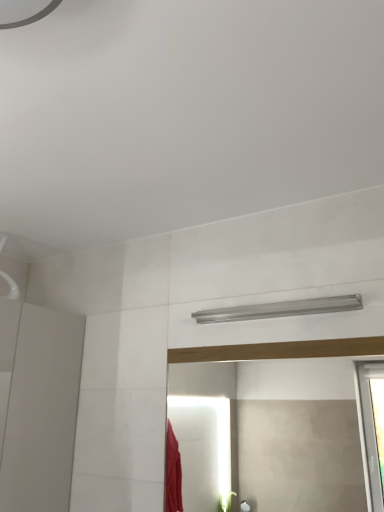
This screenshot has height=512, width=384. Describe the element at coordinates (288, 429) in the screenshot. I see `matte wooden mirror at center` at that location.

In order to click on matte wooden mirror at center in this screenshot , I will do `click(288, 429)`.

Describe the element at coordinates (280, 309) in the screenshot. I see `silver metallic shower at upper center` at that location.

Locate an element on the screen. This screenshot has height=512, width=384. silver metallic shower at upper center is located at coordinates 280,309.

At what (x,y) coordinates should I click in order to perform the action: click on matte wooden mirror at center. Please return your answer as a coordinate pair (x, y). The height and width of the screenshot is (512, 384). Looking at the image, I should click on (288, 429).

From the picture: Considering the relative positions of matte wooden mirror at center and silver metallic shower at upper center in the image provided, is matte wooden mirror at center to the left or to the right of silver metallic shower at upper center?

In the image, matte wooden mirror at center appears on the left side of silver metallic shower at upper center.

Which object is closer to the camera, matte wooden mirror at center or silver metallic shower at upper center?

matte wooden mirror at center is in front.

Does point (348, 385) come behind point (203, 318)?

No, (348, 385) is closer to viewer.

From the image's perspective, between matte wooden mirror at center and silver metallic shower at upper center, who is located below?

From the image's view, matte wooden mirror at center is below.

Based on the photo, from a real-world perspective, between matte wooden mirror at center and silver metallic shower at upper center, who is vertically higher?

silver metallic shower at upper center, from a real-world perspective.

Is matte wooden mirror at center wider or thinner than silver metallic shower at upper center?

Considering their sizes, matte wooden mirror at center looks slimmer than silver metallic shower at upper center.

Does matte wooden mirror at center have a greater height compared to silver metallic shower at upper center?

Indeed, matte wooden mirror at center has a greater height compared to silver metallic shower at upper center.

In terms of size, does matte wooden mirror at center appear bigger or smaller than silver metallic shower at upper center?

In the image, matte wooden mirror at center appears to be larger than silver metallic shower at upper center.

Is matte wooden mirror at center inside or outside of silver metallic shower at upper center?

matte wooden mirror at center exists outside the volume of silver metallic shower at upper center.

Are matte wooden mirror at center and silver metallic shower at upper center located far from each other?

Yes, matte wooden mirror at center and silver metallic shower at upper center are located far from each other.

Could you tell me if matte wooden mirror at center is turned towards silver metallic shower at upper center?

No, matte wooden mirror at center is not aimed at silver metallic shower at upper center.

What's the angular difference between matte wooden mirror at center and silver metallic shower at upper center's facing directions?

The angle between the facing direction of matte wooden mirror at center and the facing direction of silver metallic shower at upper center is 0.555 degrees.

The width and height of the screenshot is (384, 512). Identify the location of mirror to the left of silver metallic shower at upper center. (288, 429).

Which is more to the left, silver metallic shower at upper center or matte wooden mirror at center?

matte wooden mirror at center is more to the left.

Between silver metallic shower at upper center and matte wooden mirror at center, which one is positioned behind?

silver metallic shower at upper center is behind.

Considering the positions of points (279, 314) and (171, 388), is point (279, 314) farther from camera compared to point (171, 388)?

No, (279, 314) is closer to viewer.

From the image's perspective, is silver metallic shower at upper center positioned above or below matte wooden mirror at center?

Based on their image positions, silver metallic shower at upper center is located above matte wooden mirror at center.

Looking at this image, from a real-world perspective, relative to matte wooden mirror at center, is silver metallic shower at upper center vertically above or below?

In terms of real-world spatial position, silver metallic shower at upper center is above matte wooden mirror at center.

Based on the photo, between silver metallic shower at upper center and matte wooden mirror at center, which one has larger width?

With larger width is silver metallic shower at upper center.

Looking at this image, between silver metallic shower at upper center and matte wooden mirror at center, which one has more height?

matte wooden mirror at center is taller.

Who is bigger, silver metallic shower at upper center or matte wooden mirror at center?

With larger size is matte wooden mirror at center.

In the scene shown: Is matte wooden mirror at center a part of silver metallic shower at upper center?

No, matte wooden mirror at center is not surrounded by silver metallic shower at upper center.

Is silver metallic shower at upper center directly adjacent to matte wooden mirror at center?

No, silver metallic shower at upper center is not next to matte wooden mirror at center.

Is silver metallic shower at upper center turned away from matte wooden mirror at center?

silver metallic shower at upper center is not turned away from matte wooden mirror at center.

How different are the orientations of silver metallic shower at upper center and matte wooden mirror at center in degrees?

There is a 0.555-degree angle between the facing directions of silver metallic shower at upper center and matte wooden mirror at center.

The height and width of the screenshot is (512, 384). I want to click on mirror on the left of silver metallic shower at upper center, so click(x=288, y=429).

Identify the location of mirror that appears in front of the silver metallic shower at upper center. (288, 429).

You are a GUI agent. You are given a task and a screenshot of the screen. Output one action in this format:
    pyautogui.click(x=<x>, y=<y>)
    Task: Click on the shower that is behind the matte wooden mirror at center
    
    Given the screenshot: What is the action you would take?
    pyautogui.click(x=280, y=309)